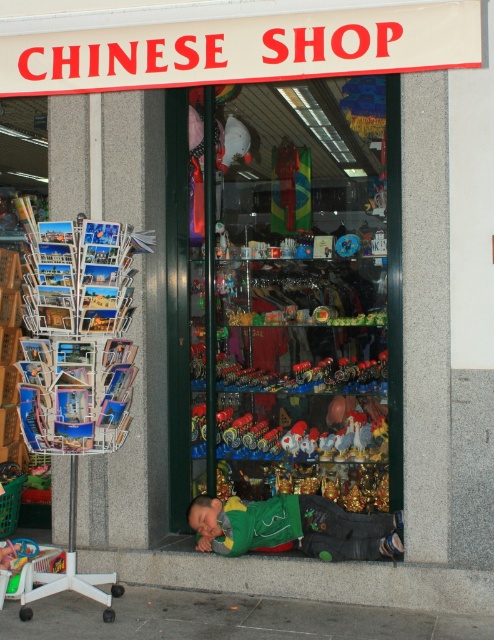
Is point (275, 602) less distant than point (361, 545)?

That is True.

You are a GUI agent. You are given a task and a screenshot of the screen. Output one action in this format:
    pyautogui.click(x=<x>, y=<y>)
    Task: Click on the gray concrete pavement at lower center
    This screenshot has height=640, width=494.
    Given the screenshot: What is the action you would take?
    pyautogui.click(x=230, y=618)